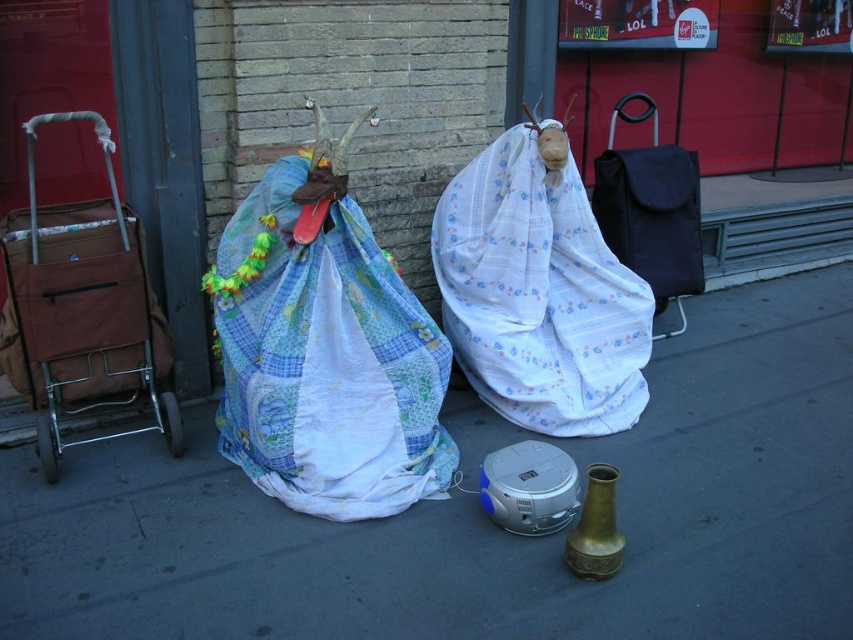
Question: Estimate the real-world distances between objects in this image. Which object is closer to the white floral fabric at center?

Choices:
 (A) smooth concrete pavement at center
 (B) patchwork fabric bag at center-left

Answer: (A)

Question: Can you confirm if smooth concrete pavement at center is bigger than brown fabric cart at left?

Choices:
 (A) no
 (B) yes

Answer: (B)

Question: Can you confirm if smooth concrete pavement at center is bigger than black fabric bag at center?

Choices:
 (A) no
 (B) yes

Answer: (B)

Question: Where is smooth concrete pavement at center located in relation to patchwork fabric bag at center-left in the image?

Choices:
 (A) below
 (B) above

Answer: (A)

Question: Among these points, which one is nearest to the camera?

Choices:
 (A) (47, 246)
 (B) (219, 284)

Answer: (A)

Question: Among these points, which one is farthest from the camera?

Choices:
 (A) (84, 273)
 (B) (144, 528)
 (C) (567, 310)
 (D) (641, 236)

Answer: (D)